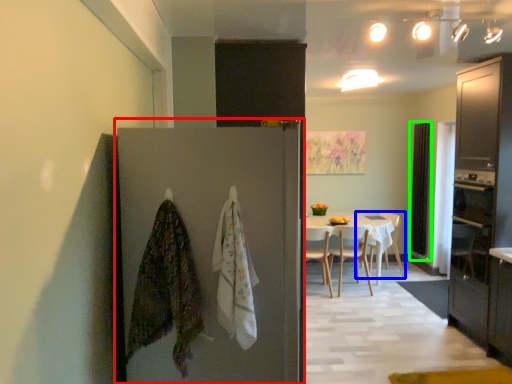
Question: Which object is positioned farthest from door (highlighted by a red box)? Select from chair (highlighted by a blue box) and screen door (highlighted by a green box).

Choices:
 (A) chair
 (B) screen door

Answer: (B)